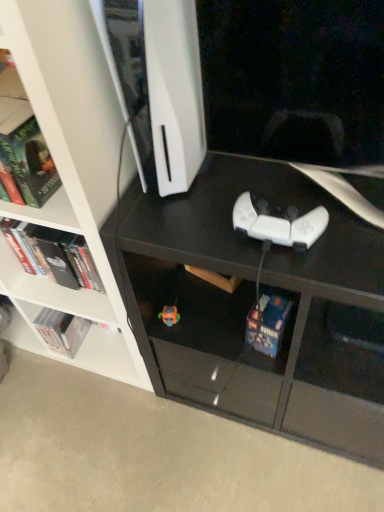
This screenshot has height=512, width=384. What do you see at coordinates (55, 254) in the screenshot?
I see `hardcover book at left, which ranks as the second book in back-to-front order` at bounding box center [55, 254].

In order to click on hardcover book at lower center, which ranks as the first book in right-to-left order in this screenshot , I will do `click(267, 324)`.

Is white matte game controller at center outside of hardcover book at lower center, which is counted as the third book, starting from the left?

Yes.

Which is behind, white matte game controller at center or hardcover book at lower center, marked as the 3th book in a back-to-front arrangement?

hardcover book at lower center, marked as the 3th book in a back-to-front arrangement, is further from the camera.

Can you confirm if white matte game controller at center is thinner than hardcover book at lower center, arranged as the first book when viewed from the front?

In fact, white matte game controller at center might be wider than hardcover book at lower center, arranged as the first book when viewed from the front.

Does white matte game controller at center have a greater height compared to hardcover book at lower center, marked as the 3th book in a back-to-front arrangement?

Incorrect, the height of white matte game controller at center is not larger of that of hardcover book at lower center, marked as the 3th book in a back-to-front arrangement.

Between translucent orange toy at lower center and hardcover book at left, which is the 2th book from right to left, which one is positioned behind?

Positioned behind is translucent orange toy at lower center.

Is translucent orange toy at lower center wider or thinner than hardcover book at left, the second book when ordered from front to back?

Considering their sizes, translucent orange toy at lower center looks slimmer than hardcover book at left, the second book when ordered from front to back.

In the scene shown: From a real-world perspective, is translucent orange toy at lower center positioned above or below hardcover book at left, the second book when ordered from front to back?

translucent orange toy at lower center is below hardcover book at left, the second book when ordered from front to back.

Can you confirm if translucent orange toy at lower center is smaller than hardcover book at left, which is the 2th book from right to left?

Yes, translucent orange toy at lower center is smaller than hardcover book at left, which is the 2th book from right to left.

Would you say translucent orange toy at lower center is inside or outside white matte game controller at center?

translucent orange toy at lower center is outside white matte game controller at center.

Who is bigger, translucent orange toy at lower center or white matte game controller at center?

white matte game controller at center.

Is point (172, 310) more distant than point (291, 239)?

Yes, it is behind point (291, 239).

Which of these two, translucent orange toy at lower center or white matte game controller at center, is thinner?

Thinner between the two is translucent orange toy at lower center.

Is hardcover book at left, which ranks as the second book in back-to-front order, oriented away from white matte game controller at center?

No, hardcover book at left, which ranks as the second book in back-to-front order, is not facing the opposite direction of white matte game controller at center.

Would you consider hardcover book at left, which is the 2th book from right to left, to be distant from white matte game controller at center?

No, hardcover book at left, which is the 2th book from right to left, is not far away from white matte game controller at center.

From the image's perspective, is hardcover book at left, which ranks as the second book in back-to-front order, under white matte game controller at center?

Yes, from the image's perspective, hardcover book at left, which ranks as the second book in back-to-front order, is beneath white matte game controller at center.

Can you confirm if hardcover book at left, the second book when ordered from front to back, is taller than white matte bookshelf at upper left?

No, hardcover book at left, the second book when ordered from front to back, is not taller than white matte bookshelf at upper left.

Between hardcover book at left, acting as the second book starting from the left, and white matte bookshelf at upper left, which one has larger width?

Wider between the two is white matte bookshelf at upper left.

Considering the positions of objects hardcover book at left, acting as the second book starting from the left, and white matte bookshelf at upper left in the image provided, who is more to the left, hardcover book at left, acting as the second book starting from the left, or white matte bookshelf at upper left?

white matte bookshelf at upper left.

Relative to translucent orange toy at lower center, is hardcover book at left, acting as the second book starting from the left, in front or behind?

hardcover book at left, acting as the second book starting from the left, is positioned closer to the viewer than translucent orange toy at lower center.

The width and height of the screenshot is (384, 512). Find the location of `toy that appears below the hardcover book at left, acting as the second book starting from the left (from the image's perspective)`. toy that appears below the hardcover book at left, acting as the second book starting from the left (from the image's perspective) is located at coordinates (169, 315).

Is hardcover book at left, acting as the second book starting from the left, wider or thinner than translucent orange toy at lower center?

Considering their sizes, hardcover book at left, acting as the second book starting from the left, looks broader than translucent orange toy at lower center.

What's the angular difference between hardcover book at left, acting as the second book starting from the left, and translucent orange toy at lower center's facing directions?

The facing directions of hardcover book at left, acting as the second book starting from the left, and translucent orange toy at lower center are 11.1 degrees apart.

How many degrees apart are the facing directions of hardcover book at lower center, which is counted as the third book, starting from the left, and hardcover book at left, which ranks as the second book in back-to-front order?

The angle between the facing direction of hardcover book at lower center, which is counted as the third book, starting from the left, and the facing direction of hardcover book at left, which ranks as the second book in back-to-front order, is 12.7 degrees.

Are hardcover book at lower center, arranged as the first book when viewed from the front, and hardcover book at left, acting as the second book starting from the left, far apart?

hardcover book at lower center, arranged as the first book when viewed from the front, is near hardcover book at left, acting as the second book starting from the left, not far away.

Considering the relative sizes of hardcover book at lower center, arranged as the first book when viewed from the front, and hardcover book at left, which is the 2th book from right to left, in the image provided, is hardcover book at lower center, arranged as the first book when viewed from the front, thinner than hardcover book at left, which is the 2th book from right to left,?

No, hardcover book at lower center, arranged as the first book when viewed from the front, is not thinner than hardcover book at left, which is the 2th book from right to left.

Is hardcover book at lower center, marked as the 3th book in a back-to-front arrangement, oriented towards hardcover book at left, the second book when ordered from front to back?

No, hardcover book at lower center, marked as the 3th book in a back-to-front arrangement, does not turn towards hardcover book at left, the second book when ordered from front to back.

There is a white matte game controller at center. Identify the location of the 2nd book below it (from a real-world perspective). Image resolution: width=384 pixels, height=512 pixels. (267, 324).

The image size is (384, 512). Find the location of `the 1st book counting from the left side of the translucent orange toy at lower center`. the 1st book counting from the left side of the translucent orange toy at lower center is located at coordinates (55, 254).

Considering their positions, is white matte bookshelf at upper left positioned closer to translucent orange toy at lower center than white glossy book at lower left, the 1th book when ordered from left to right?

white matte bookshelf at upper left.

Considering their positions, is hardcover book at lower center, arranged as the first book when viewed from the front, positioned closer to white matte bookshelf at upper left than white glossy book at lower left, the 1th book when ordered from left to right?

white glossy book at lower left, the 1th book when ordered from left to right, is positioned closer to the anchor white matte bookshelf at upper left.

Estimate the real-world distances between objects in this image. Which object is further from hardcover book at left, which ranks as the second book in back-to-front order, translucent orange toy at lower center or hardcover book at lower center, which ranks as the first book in right-to-left order?

hardcover book at lower center, which ranks as the first book in right-to-left order, is further to hardcover book at left, which ranks as the second book in back-to-front order.

From the image, which object appears to be farther from white matte game controller at center, hardcover book at left, the second book when ordered from front to back, or translucent orange toy at lower center?

hardcover book at left, the second book when ordered from front to back, is further to white matte game controller at center.

Looking at the image, which one is located closer to green matte bookshelf at upper left, white glossy book at lower left, which is the third book in front-to-back order, or hardcover book at lower center, arranged as the first book when viewed from the front?

Among the two, hardcover book at lower center, arranged as the first book when viewed from the front, is located nearer to green matte bookshelf at upper left.

Estimate the real-world distances between objects in this image. Which object is further from white glossy book at lower left, the 1th book viewed from the back, hardcover book at lower center, arranged as the first book when viewed from the front, or green matte bookshelf at upper left?

The object further to white glossy book at lower left, the 1th book viewed from the back, is hardcover book at lower center, arranged as the first book when viewed from the front.

From the image, which object appears to be farther from white glossy book at lower left, the 1th book when ordered from left to right, white matte game controller at center or white matte bookshelf at upper left?

white matte game controller at center.

From the image, which object appears to be farther from hardcover book at lower center, marked as the 3th book in a back-to-front arrangement, hardcover book at left, which is the 2th book from right to left, or white glossy book at lower left, the 3th book viewed from the right?

white glossy book at lower left, the 3th book viewed from the right.

I want to click on shelf between white glossy book at lower left, the 3th book viewed from the right, and hardcover book at lower center, arranged as the first book when viewed from the front, from left to right, so click(43, 194).

This screenshot has height=512, width=384. I want to click on toy between green matte bookshelf at upper left and white glossy book at lower left, which is the third book in front-to-back order, from front to back, so click(169, 315).

The height and width of the screenshot is (512, 384). I want to click on book situated between white glossy book at lower left, the 3th book viewed from the right, and translucent orange toy at lower center from left to right, so click(55, 254).

Locate an element on the screen. This screenshot has height=512, width=384. toy between green matte bookshelf at upper left and white matte game controller at center in the horizontal direction is located at coordinates (169, 315).